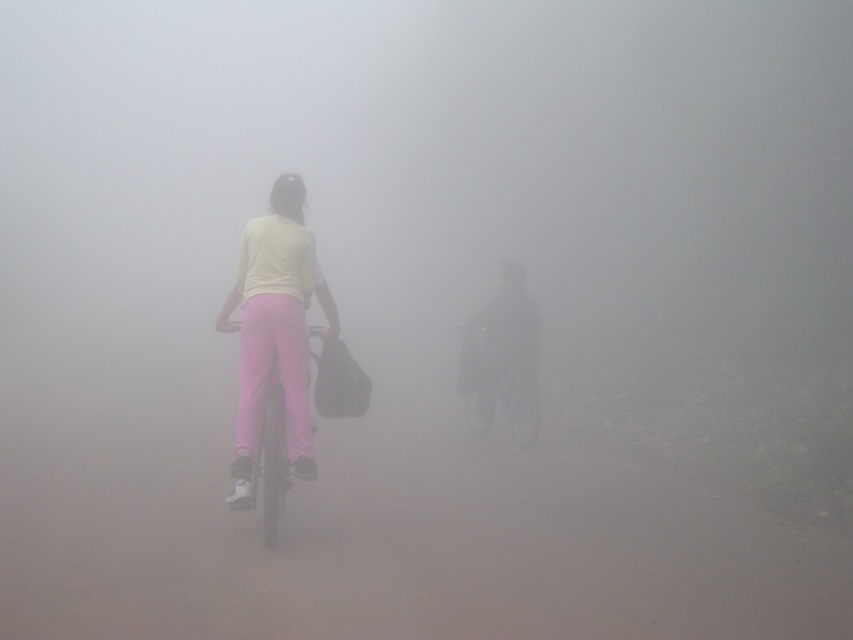
You are a cyclist trying to follow the two people in the foggy scene. You see the dark matte jacket at center and the matte pink bicycle at center. Which object should you focus on to stay on the correct path?

You should focus on the matte pink bicycle at center because the dark matte jacket at center is located above it, indicating the jacket is on the rider of the bicycle. Following the bicycle will keep you on the correct path.

You are a pedestrian trying to cross the path where the matte pink pants at center and the dark matte jacket at center are riding their bicycles. To avoid collision, you need to know which cyclist is closer to the left side of the path. Which one should you watch out for?

The matte pink pants at center is positioned on the left side of dark matte jacket at center, so you should watch out for the cyclist with the matte pink pants at center as they are closer to the left side of the path.

You are standing at the point marked by the coordinates point (500,355). Which object are you currently standing on?

You are standing on the dark matte jacket at center.